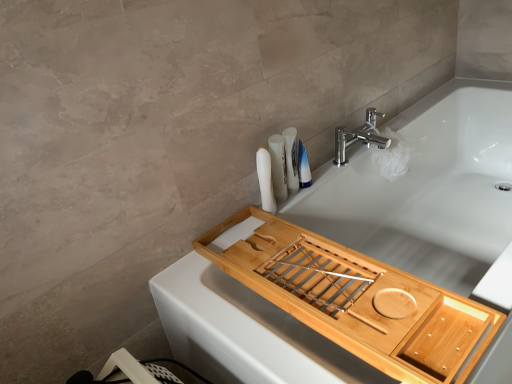
Question: From the image's perspective, is natural wood tray at upper right located beneath white matte toothbrushes at upper right, arranged as the 2th toiletry when viewed from the right?

Choices:
 (A) no
 (B) yes

Answer: (B)

Question: Does natural wood tray at upper right appear on the right side of white matte toothbrushes at upper right, positioned as the 2th toiletry in left-to-right order?

Choices:
 (A) no
 (B) yes

Answer: (B)

Question: Is natural wood tray at upper right facing towards white matte toothbrushes at upper right, arranged as the 2th toiletry when viewed from the right?

Choices:
 (A) yes
 (B) no

Answer: (B)

Question: Is white matte toothbrushes at upper right, arranged as the 2th toiletry when viewed from the right, at the back of natural wood tray at upper right?

Choices:
 (A) yes
 (B) no

Answer: (B)

Question: Are natural wood tray at upper right and white matte toothbrushes at upper right, arranged as the 2th toiletry when viewed from the right, located far from each other?

Choices:
 (A) yes
 (B) no

Answer: (B)

Question: From a real-world perspective, is natural wood tray at upper right over white matte toothbrushes at upper right, positioned as the 2th toiletry in left-to-right order?

Choices:
 (A) yes
 (B) no

Answer: (B)

Question: From the image's perspective, does blue glossy bottle at upper right, which appears as the first toiletry when viewed from the right, appear lower than natural wood tray at upper right?

Choices:
 (A) no
 (B) yes

Answer: (A)

Question: Is blue glossy bottle at upper right, which appears as the first toiletry when viewed from the right, to the left of natural wood tray at upper right from the viewer's perspective?

Choices:
 (A) no
 (B) yes

Answer: (A)

Question: Can you confirm if blue glossy bottle at upper right, which appears as the first toiletry when viewed from the right, is thinner than natural wood tray at upper right?

Choices:
 (A) no
 (B) yes

Answer: (B)

Question: Is blue glossy bottle at upper right, which ranks as the 3th toiletry in left-to-right order, aimed at natural wood tray at upper right?

Choices:
 (A) no
 (B) yes

Answer: (A)

Question: Is blue glossy bottle at upper right, which ranks as the 3th toiletry in left-to-right order, placed right next to natural wood tray at upper right?

Choices:
 (A) yes
 (B) no

Answer: (B)

Question: Does chrome/metallic faucet at upper right appear on the left side of blue glossy bottle at upper right, which appears as the first toiletry when viewed from the right?

Choices:
 (A) no
 (B) yes

Answer: (A)